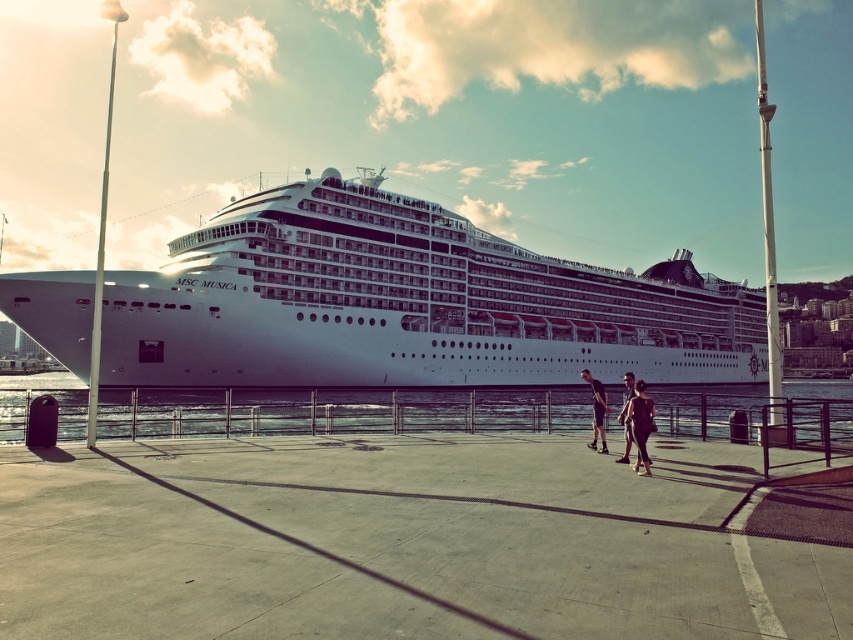
Does matte black clothing at center have a greater width compared to dark gray fabric pants at center?

Yes, matte black clothing at center is wider than dark gray fabric pants at center.

Is point (643, 470) positioned before point (595, 416)?

Yes, point (643, 470) is in front of point (595, 416).

This screenshot has width=853, height=640. What do you see at coordinates (637, 420) in the screenshot?
I see `matte black clothing at center` at bounding box center [637, 420].

Where is `matte black clothing at center`? This screenshot has height=640, width=853. matte black clothing at center is located at coordinates coord(637,420).

Which is in front, point (238, 332) or point (647, 406)?

Point (647, 406) is in front.

Is point (239, 346) closer to camera compared to point (637, 428)?

No, it is behind (637, 428).

Does point (68, 337) lie in front of point (633, 380)?

That is False.

Where is `white glossy cruise ship at center`? The image size is (853, 640). white glossy cruise ship at center is located at coordinates (384, 305).

Can you confirm if matte black clothing at center is smaller than matte black shorts at center?

Yes, matte black clothing at center is smaller than matte black shorts at center.

Which is behind, point (630, 412) or point (633, 388)?

The point (633, 388) is behind.

In order to click on matte black clothing at center in this screenshot , I will do `click(637, 420)`.